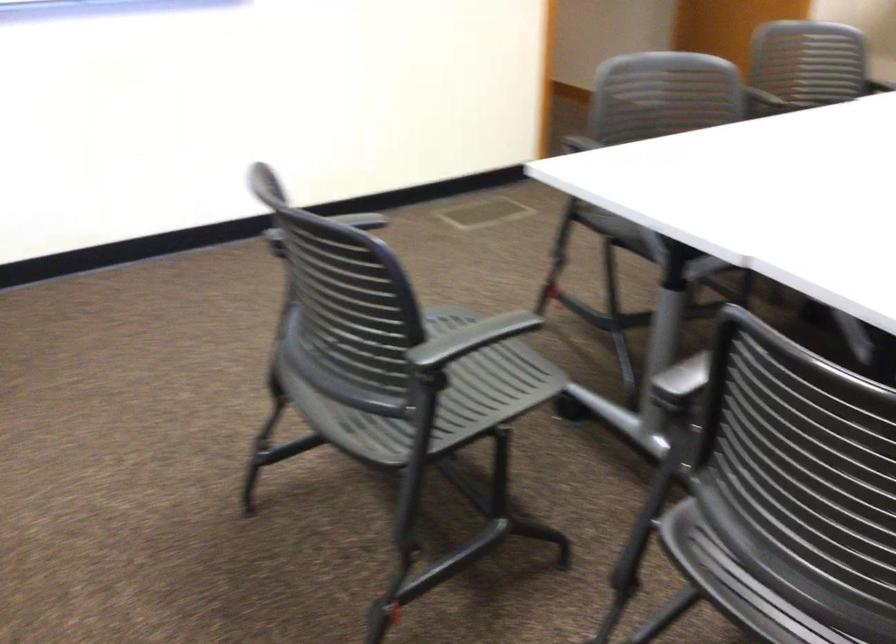
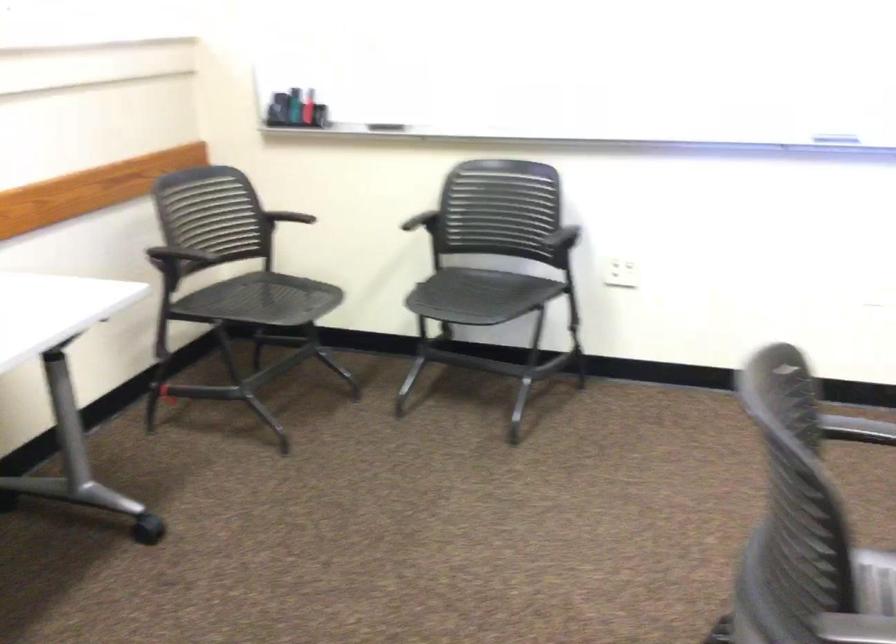
Question: The first image is from the beginning of the video and the second image is from the end. How did the camera likely rotate when shooting the video?

Choices:
 (A) Left
 (B) Right
 (C) Up
 (D) Down

Answer: (A)